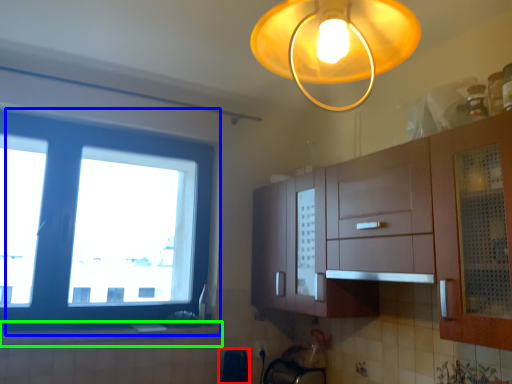
Question: Which is nearer to the appliance (highlighted by a red box)? window (highlighted by a blue box) or counter top (highlighted by a green box).

Choices:
 (A) window
 (B) counter top

Answer: (B)